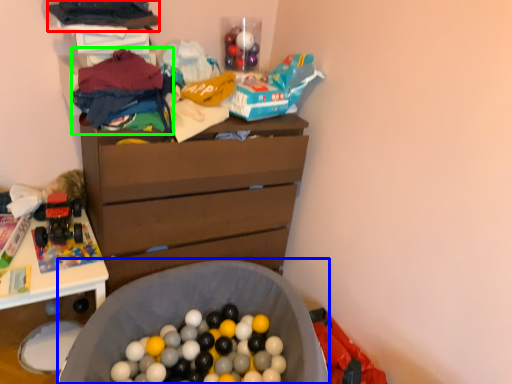
Question: Based on their relative distances, which object is farther from clothing (highlighted by a red box)? Choose from laundry basket (highlighted by a blue box) and clothing (highlighted by a green box).

Choices:
 (A) laundry basket
 (B) clothing

Answer: (A)